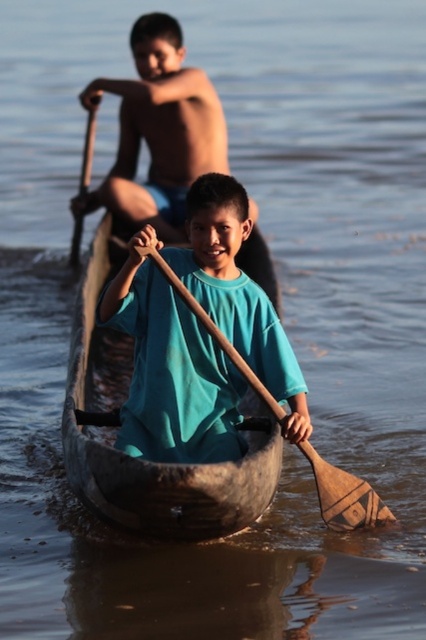
Who is lower down, wooden paddle at center or wooden paddle at upper left?

Positioned lower is wooden paddle at center.

In order to click on wooden paddle at center in this screenshot , I will do `click(344, 496)`.

Find the location of `wooden paddle at center`. wooden paddle at center is located at coordinates (344, 496).

Which is above, brown wooden boat at center or wooden paddle at center?

brown wooden boat at center

Is point (152, 476) positioned after point (391, 515)?

That is False.

Is point (273, 432) more distant than point (250, 368)?

No.

Locate an element on the screen. Image resolution: width=426 pixels, height=640 pixels. brown wooden boat at center is located at coordinates (141, 460).

How distant is brown wooden boat at center from wooden paddle at upper left?

brown wooden boat at center is 5.98 meters away from wooden paddle at upper left.

Can you confirm if brown wooden boat at center is positioned above wooden paddle at upper left?

Actually, brown wooden boat at center is below wooden paddle at upper left.

The width and height of the screenshot is (426, 640). What are the coordinates of `brown wooden boat at center` in the screenshot? It's located at (141, 460).